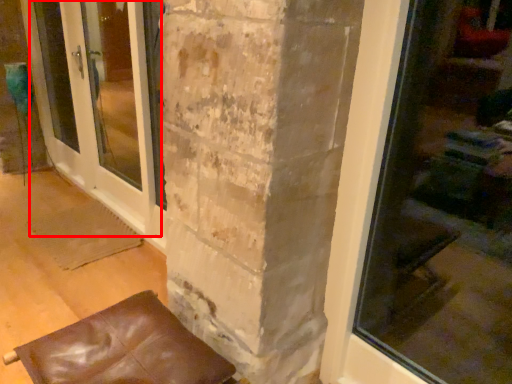
Question: Considering the relative positions of screen door (annotated by the red box) and furniture in the image provided, where is screen door (annotated by the red box) located with respect to the staircase?

Choices:
 (A) right
 (B) left

Answer: (B)